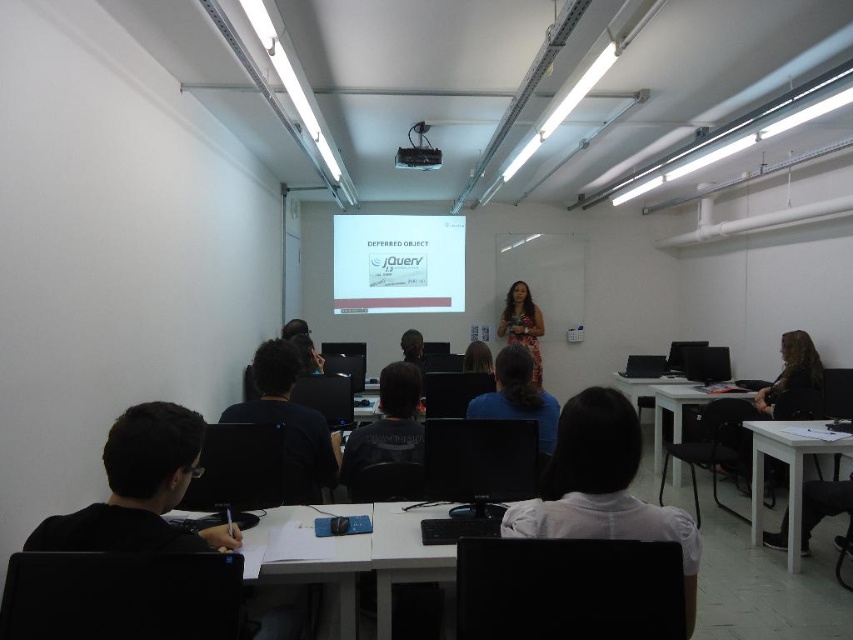
You are a student sitting at the back of the classroom. You notice the white matte shirt at center and the white plastic table at lower center. Which object is positioned higher from the floor?

The white matte shirt at center is above the white plastic table at lower center, so it is positioned higher from the floor.